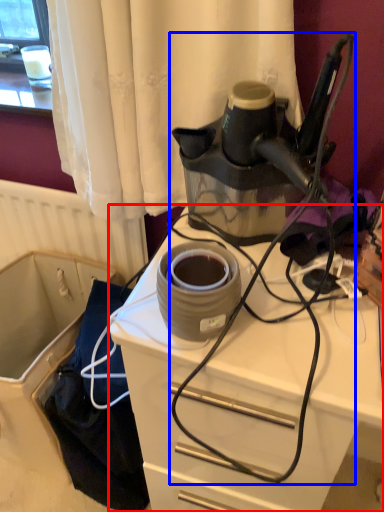
Question: Among these objects, which one is nearest to the camera, desk (highlighted by a red box) or wire (highlighted by a blue box)?

Choices:
 (A) desk
 (B) wire

Answer: (B)